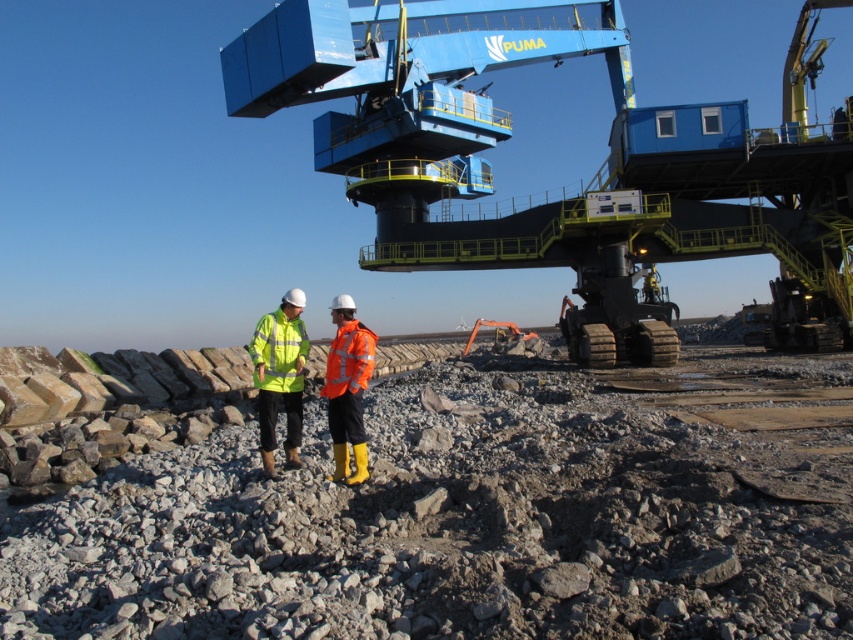
Question: Is gray gravel at center further to camera compared to orange reflective jacket at center?

Choices:
 (A) no
 (B) yes

Answer: (A)

Question: Among these objects, which one is nearest to the camera?

Choices:
 (A) blue metallic crane at upper center
 (B) high-visibility fabric jacket at center
 (C) gray gravel at center

Answer: (C)

Question: Which of the following is the closest to the observer?

Choices:
 (A) blue metallic crane at upper center
 (B) orange reflective jacket at center
 (C) high-visibility fabric jacket at center
 (D) gray gravel at center

Answer: (D)

Question: Does gray gravel at center have a larger size compared to orange reflective jacket at center?

Choices:
 (A) no
 (B) yes

Answer: (B)

Question: Considering the relative positions of high-visibility fabric jacket at center and orange reflective jacket at center in the image provided, where is high-visibility fabric jacket at center located with respect to orange reflective jacket at center?

Choices:
 (A) right
 (B) left

Answer: (B)

Question: Estimate the real-world distances between objects in this image. Which object is farther from the blue metallic crane at upper center?

Choices:
 (A) orange reflective jacket at center
 (B) high-visibility fabric jacket at center
 (C) gray gravel at center

Answer: (B)